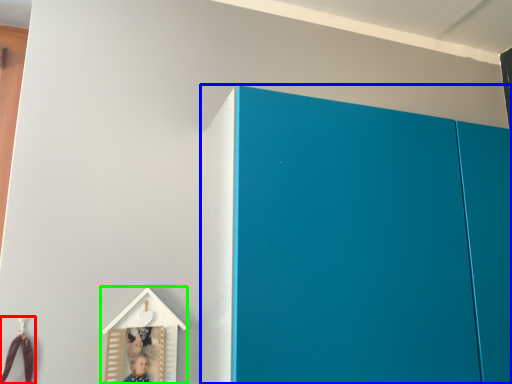
Question: Which object is the farthest from toy (highlighted by a red box)? Choose among these: cupboard (highlighted by a blue box) or toy (highlighted by a green box).

Choices:
 (A) cupboard
 (B) toy

Answer: (A)